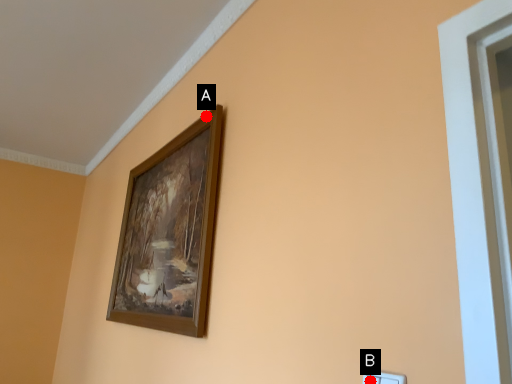
Question: Two points are circled on the image, labeled by A and B beside each circle. Which point is further to the camera?

Choices:
 (A) A is further
 (B) B is further

Answer: (A)